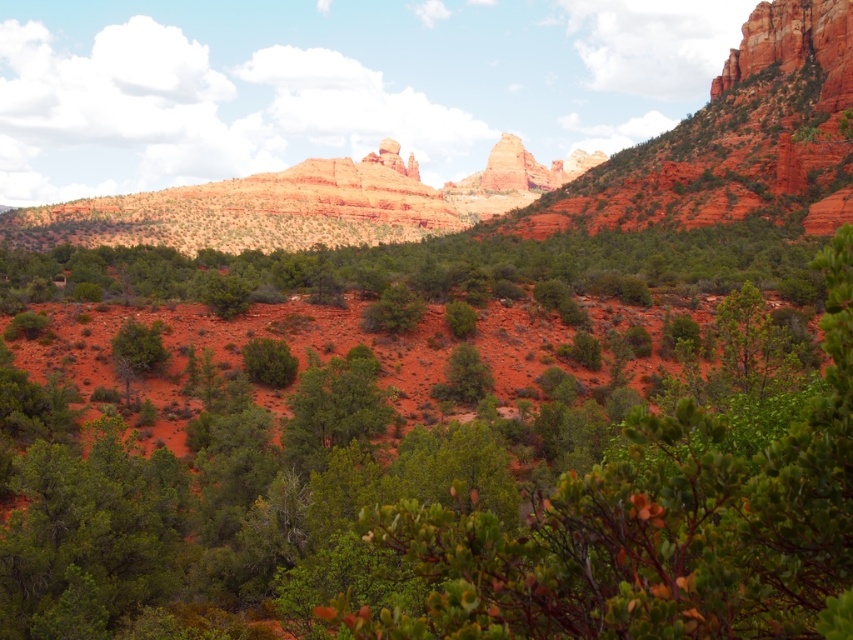
Question: Is green leafy shrub at center in front of reddish-brown rock formation at center?

Choices:
 (A) yes
 (B) no

Answer: (A)

Question: Which object appears farthest from the camera in this image?

Choices:
 (A) green leafy shrub at center
 (B) reddish-brown rock formation at center

Answer: (B)

Question: Does green leafy shrub at center lie in front of reddish-brown rock formation at center?

Choices:
 (A) no
 (B) yes

Answer: (B)

Question: Among these points, which one is nearest to the camera?

Choices:
 (A) (402, 618)
 (B) (107, 212)

Answer: (A)

Question: Is green leafy shrub at center positioned in front of reddish-brown rock formation at center?

Choices:
 (A) yes
 (B) no

Answer: (A)

Question: Which object appears closest to the camera in this image?

Choices:
 (A) green leafy shrub at center
 (B) reddish-brown rock formation at center

Answer: (A)